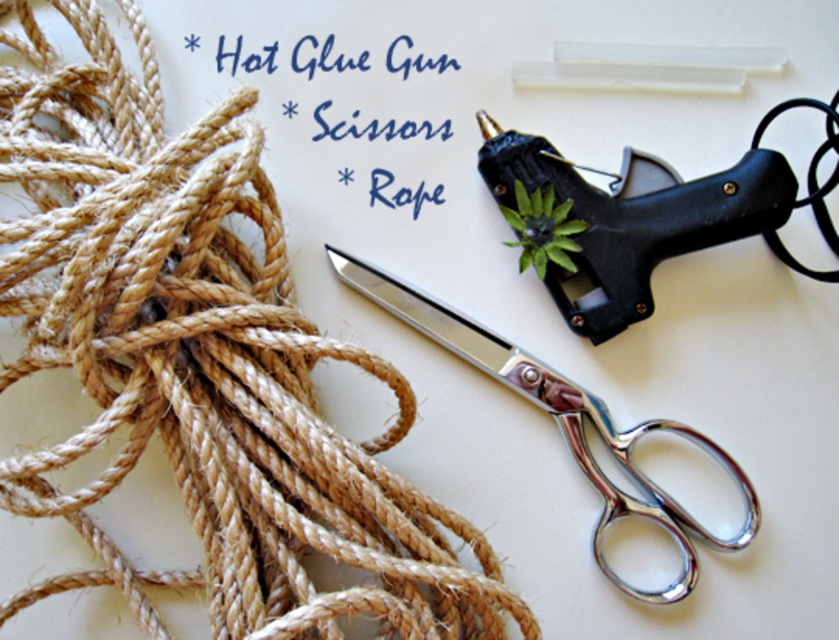
Which is more to the left, polished metal scissors at center or green leafy plant at upper center?

polished metal scissors at center is more to the left.

Who is more distant from viewer, (752,504) or (546,214)?

Point (546,214)

Where is `polished metal scissors at center`? Image resolution: width=839 pixels, height=640 pixels. polished metal scissors at center is located at coordinates (564, 422).

What are the coordinates of `black plastic hot glue gun at upper right` in the screenshot? It's located at (644, 218).

Which is more to the left, black plastic hot glue gun at upper right or green leafy plant at upper center?

Positioned to the left is green leafy plant at upper center.

Image resolution: width=839 pixels, height=640 pixels. I want to click on black plastic hot glue gun at upper right, so click(x=644, y=218).

Measure the distance between natural jute rope at left and camera.

A distance of 3.61 feet exists between natural jute rope at left and camera.

Is point (178, 179) positioned before point (535, 228)?

That is True.

Between point (335, 440) and point (525, 241), which one is positioned behind?

The point (525, 241) is more distant.

The image size is (839, 640). I want to click on natural jute rope at left, so click(202, 362).